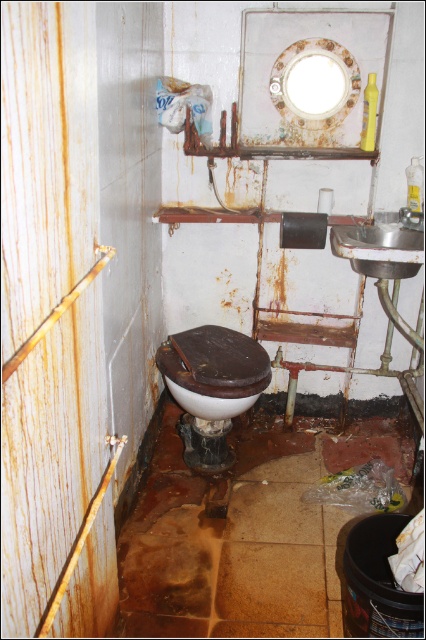
Does white glossy toilet bowl at center have a smaller size compared to satin silver sink at right?

Incorrect, white glossy toilet bowl at center is not smaller in size than satin silver sink at right.

Locate an element on the screen. The image size is (426, 640). white glossy toilet bowl at center is located at coordinates (213, 371).